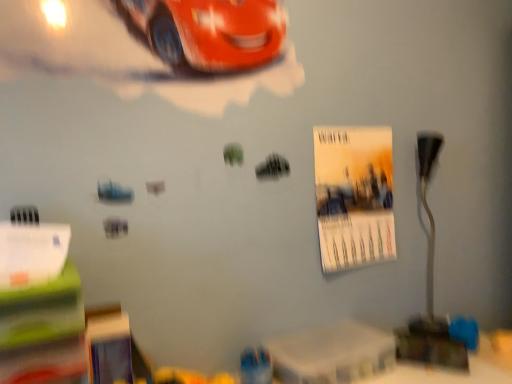
Question: Considering the relative sizes of metallic silver table lamp at right and matte paper poster at center right in the image provided, is metallic silver table lamp at right smaller than matte paper poster at center right?

Choices:
 (A) yes
 (B) no

Answer: (A)

Question: Does metallic silver table lamp at right have a larger size compared to matte paper poster at center right?

Choices:
 (A) no
 (B) yes

Answer: (A)

Question: From a real-world perspective, is metallic silver table lamp at right physically above matte paper poster at center right?

Choices:
 (A) yes
 (B) no

Answer: (B)

Question: Does metallic silver table lamp at right have a lesser height compared to matte paper poster at center right?

Choices:
 (A) yes
 (B) no

Answer: (B)

Question: Is matte paper poster at center right at the back of metallic silver table lamp at right?

Choices:
 (A) no
 (B) yes

Answer: (A)

Question: From the image's perspective, does metallic silver table lamp at right appear lower than matte paper poster at center right?

Choices:
 (A) yes
 (B) no

Answer: (A)

Question: Is white plastic table at lower center facing towards metallic silver table lamp at right?

Choices:
 (A) yes
 (B) no

Answer: (B)

Question: From the image's perspective, does white plastic table at lower center appear lower than metallic silver table lamp at right?

Choices:
 (A) no
 (B) yes

Answer: (B)

Question: Can you confirm if white plastic table at lower center is bigger than metallic silver table lamp at right?

Choices:
 (A) no
 (B) yes

Answer: (A)

Question: Does white plastic table at lower center come in front of metallic silver table lamp at right?

Choices:
 (A) yes
 (B) no

Answer: (A)

Question: Considering the relative sizes of white plastic table at lower center and metallic silver table lamp at right in the image provided, is white plastic table at lower center wider than metallic silver table lamp at right?

Choices:
 (A) no
 (B) yes

Answer: (B)

Question: Does white plastic table at lower center have a smaller size compared to metallic silver table lamp at right?

Choices:
 (A) no
 (B) yes

Answer: (B)

Question: Can we say matte paper poster at center right lies outside metallic silver table lamp at right?

Choices:
 (A) yes
 (B) no

Answer: (A)